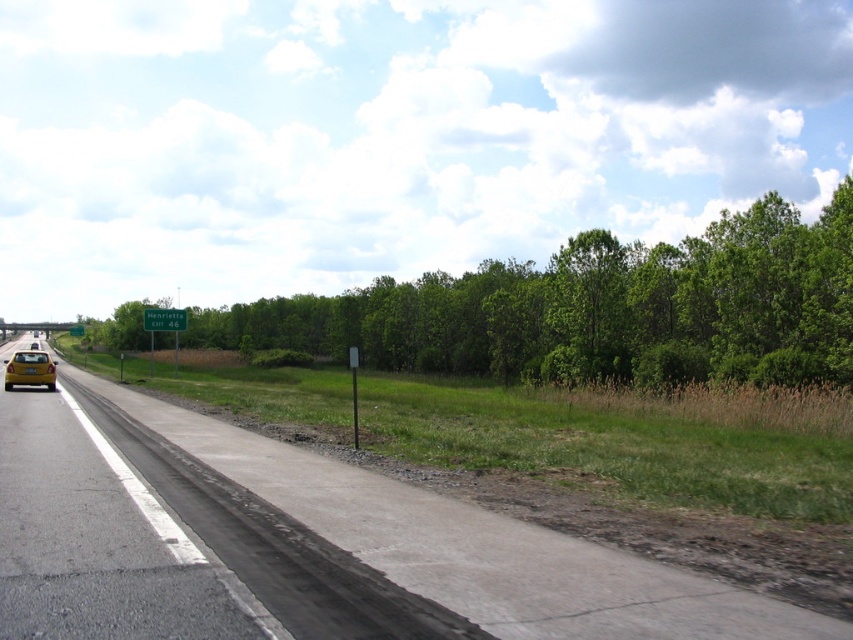
From the picture: Can you confirm if asphalt road at center is positioned above yellow matte license plate at center?

Incorrect, asphalt road at center is not positioned above yellow matte license plate at center.

Measure the distance between point (289, 589) and camera.

Point (289, 589) and camera are 5.55 meters apart.

Which is behind, point (386, 509) or point (24, 371)?

Point (24, 371)

Find the location of a particular element. The image size is (853, 640). asphalt road at center is located at coordinates (308, 541).

Measure the distance between yellow matte taxi at lower left and yellow matte license plate at center.

yellow matte taxi at lower left is 11.86 feet away from yellow matte license plate at center.

Does yellow matte taxi at lower left appear over yellow matte license plate at center?

Actually, yellow matte taxi at lower left is below yellow matte license plate at center.

Identify the location of yellow matte taxi at lower left. This screenshot has width=853, height=640. (30, 372).

Is point (680, 634) farther from camera compared to point (13, 358)?

No, (680, 634) is closer to viewer.

Between asphalt road at center and yellow matte taxi at lower left, which one appears on the right side from the viewer's perspective?

asphalt road at center

The height and width of the screenshot is (640, 853). What do you see at coordinates (308, 541) in the screenshot?
I see `asphalt road at center` at bounding box center [308, 541].

Image resolution: width=853 pixels, height=640 pixels. What are the coordinates of `asphalt road at center` in the screenshot? It's located at (308, 541).